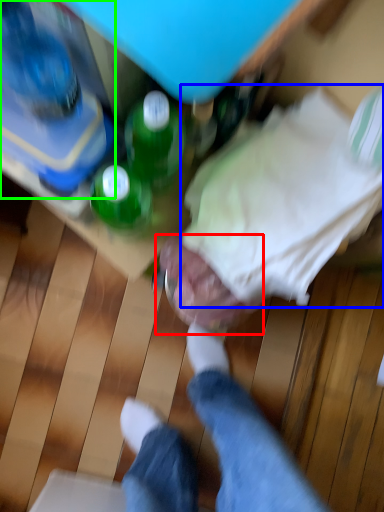
Question: Which object is the farthest from head (highlighted by a red box)? Choose among these: clothing (highlighted by a blue box) or bottle (highlighted by a green box).

Choices:
 (A) clothing
 (B) bottle

Answer: (B)